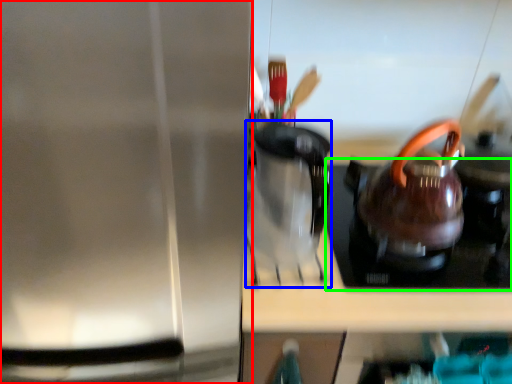
Question: Which object is the farthest from kitchen appliance (highlighted by a red box)? Choose among these: coffeepot (highlighted by a blue box) or gas stove (highlighted by a green box).

Choices:
 (A) coffeepot
 (B) gas stove

Answer: (B)